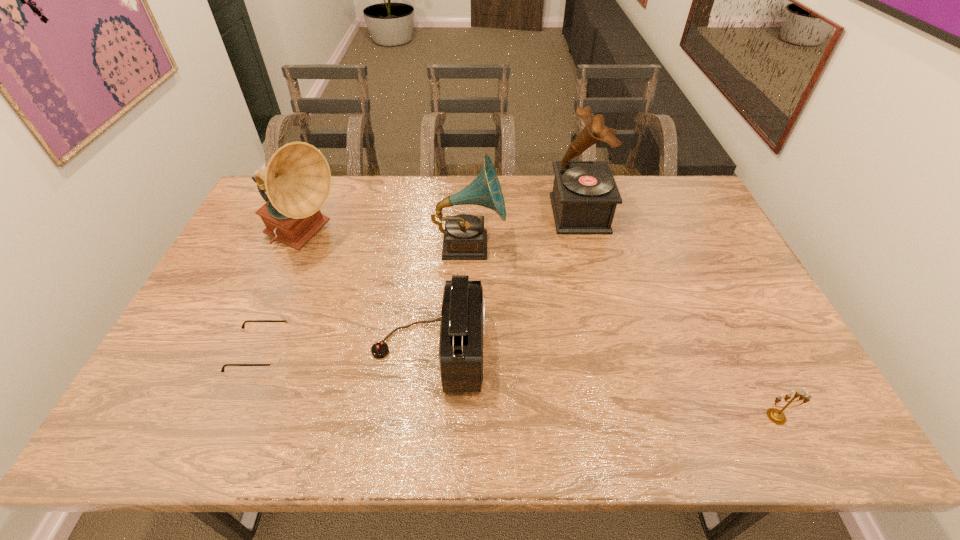
I want to click on vacant space that satisfies the following two spatial constraints: 1. from the horn of the rightmost object; 2. on the right side of the second phonograph_record from left to right, so click(465, 416).

You are a GUI agent. You are given a task and a screenshot of the screen. Output one action in this format:
    pyautogui.click(x=<x>, y=<y>)
    Task: Click on the free space that satisfies the following two spatial constraints: 1. on the horn of the leftmost phonograph_record; 2. on the left side of the fifth tallest object
    The width and height of the screenshot is (960, 540).
    Given the screenshot: What is the action you would take?
    pyautogui.click(x=229, y=416)